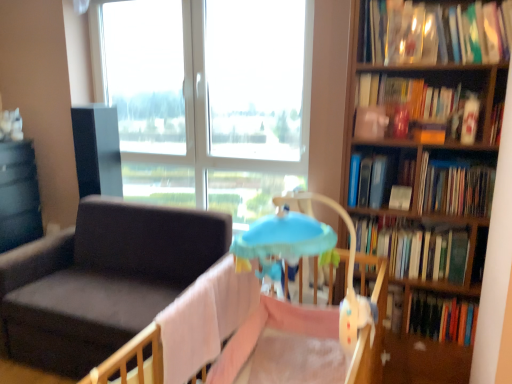
Image resolution: width=512 pixels, height=384 pixels. What do you see at coordinates (426, 220) in the screenshot? I see `wooden bookshelf at right` at bounding box center [426, 220].

What do you see at coordinates (18, 195) in the screenshot?
I see `matte black table at left` at bounding box center [18, 195].

Measure the distance between point (360, 180) and camera.

Point (360, 180) and camera are 6.72 feet apart.

What do you see at coordinates (416, 250) in the screenshot?
I see `hardcover book at right, the fifth book in the top-to-bottom sequence` at bounding box center [416, 250].

In order to face dark gray fabric chair at left, should I rotate leftwards or rightwards?

It's best to rotate left around 17.539 degrees.

The height and width of the screenshot is (384, 512). What do you see at coordinates (406, 105) in the screenshot?
I see `hardcover book at upper right, placed as the 5th book when sorted from bottom to top` at bounding box center [406, 105].

In order to face transparent glass window at upper center, should I rotate leftwards or rightwards?

Turn left by 7.454 degrees to look at transparent glass window at upper center.

The height and width of the screenshot is (384, 512). In order to click on pink fabric infant bed at center in this screenshot , I will do `click(253, 330)`.

Between pink fabric infant bed at center and hardcover book at upper right, which is counted as the third book, starting from the top, which one appears on the right side from the viewer's perspective?

hardcover book at upper right, which is counted as the third book, starting from the top, is more to the right.

Can you tell me how much pink fabric infant bed at center and hardcover book at upper right, which is counted as the third book, starting from the top, differ in facing direction?

2.36 degrees.

The height and width of the screenshot is (384, 512). I want to click on infant bed on the left of the hardcover book at upper right, which is counted as the third book, starting from the bottom, so click(x=253, y=330).

Considering the relative sizes of pink fabric infant bed at center and hardcover book at upper right, which is counted as the third book, starting from the top, in the image provided, is pink fabric infant bed at center thinner than hardcover book at upper right, which is counted as the third book, starting from the top,?

Incorrect, the width of pink fabric infant bed at center is not less than that of hardcover book at upper right, which is counted as the third book, starting from the top.

The image size is (512, 384). Find the location of `chair below the hardcover book at right, positioned as the 2th book in bottom-to-top order (from the image's perspective)`. chair below the hardcover book at right, positioned as the 2th book in bottom-to-top order (from the image's perspective) is located at coordinates (102, 280).

In the scene shown: Is dark gray fabric chair at left placed right next to hardcover book at right, which ranks as the 4th book in top-to-bottom order?

No, dark gray fabric chair at left is not touching hardcover book at right, which ranks as the 4th book in top-to-bottom order.

Is dark gray fabric chair at left to the left of hardcover book at right, positioned as the 2th book in bottom-to-top order, from the viewer's perspective?

Yes, dark gray fabric chair at left is to the left of hardcover book at right, positioned as the 2th book in bottom-to-top order.

Does dark gray fabric chair at left lie in front of hardcover book at right, which ranks as the 4th book in top-to-bottom order?

No, dark gray fabric chair at left is further to the viewer.

From the image's perspective, starting from the hardcover book at upper right, positioned as the first book in top-to-bottom order, which book is the 3rd one below? Please provide its 2D coordinates.

[(455, 188)]

Is hardcover book at right, which ranks as the 4th book in top-to-bottom order, outside of hardcover book at upper right, positioned as the first book in top-to-bottom order?

Yes, hardcover book at right, which ranks as the 4th book in top-to-bottom order, is located beyond the bounds of hardcover book at upper right, positioned as the first book in top-to-bottom order.

Considering the relative sizes of hardcover book at right, positioned as the 2th book in bottom-to-top order, and hardcover book at upper right, placed as the 5th book when sorted from bottom to top, in the image provided, is hardcover book at right, positioned as the 2th book in bottom-to-top order, wider than hardcover book at upper right, placed as the 5th book when sorted from bottom to top,?

A: Indeed, hardcover book at right, positioned as the 2th book in bottom-to-top order, has a greater width compared to hardcover book at upper right, placed as the 5th book when sorted from bottom to top.

Does hardcover book at right, positioned as the 2th book in bottom-to-top order, have a smaller size compared to hardcover book at upper right, placed as the 5th book when sorted from bottom to top?

Yes.

Is hardcover book at upper right, which is counted as the third book, starting from the top, looking in the opposite direction of hardcover book at right, positioned as the 2th book in bottom-to-top order?

hardcover book at upper right, which is counted as the third book, starting from the top, is not turned away from hardcover book at right, positioned as the 2th book in bottom-to-top order.

Is hardcover book at upper right, which is counted as the third book, starting from the top, taller or shorter than hardcover book at right, positioned as the 2th book in bottom-to-top order?

Clearly, hardcover book at upper right, which is counted as the third book, starting from the top, is shorter compared to hardcover book at right, positioned as the 2th book in bottom-to-top order.

Which is more to the left, hardcover book at upper right, which is counted as the third book, starting from the top, or hardcover book at right, which ranks as the 4th book in top-to-bottom order?

hardcover book at upper right, which is counted as the third book, starting from the top.

This screenshot has width=512, height=384. There is a hardcover book at upper right, which is counted as the third book, starting from the bottom. What are the coordinates of `the 1st book above it (from a real-world perspective)` in the screenshot? It's located at (455, 188).

Is hardcover book at upper right, which is counted as the third book, starting from the top, spatially inside transparent glass window at upper center, or outside of it?

hardcover book at upper right, which is counted as the third book, starting from the top, is outside transparent glass window at upper center.

From the image's perspective, would you say hardcover book at upper right, which is counted as the third book, starting from the bottom, is positioned over transparent glass window at upper center?

No, from the image's perspective, hardcover book at upper right, which is counted as the third book, starting from the bottom, is not on top of transparent glass window at upper center.

Is hardcover book at upper right, which is counted as the third book, starting from the bottom, shorter than transparent glass window at upper center?

Indeed, hardcover book at upper right, which is counted as the third book, starting from the bottom, has a lesser height compared to transparent glass window at upper center.

Does hardcover book at upper right, which is counted as the third book, starting from the bottom, have a lesser width compared to transparent glass window at upper center?

In fact, hardcover book at upper right, which is counted as the third book, starting from the bottom, might be wider than transparent glass window at upper center.

Based on their positions, is hardcover book at upper right, positioned as the first book in top-to-bottom order, located to the left or right of hardcover book at upper right, which is counted as the third book, starting from the bottom?

From the image, it's evident that hardcover book at upper right, positioned as the first book in top-to-bottom order, is to the right of hardcover book at upper right, which is counted as the third book, starting from the bottom.

From the image's perspective, is hardcover book at upper right, positioned as the first book in top-to-bottom order, located beneath hardcover book at upper right, which is counted as the third book, starting from the bottom?

Incorrect, from the image's perspective, hardcover book at upper right, positioned as the first book in top-to-bottom order, is higher than hardcover book at upper right, which is counted as the third book, starting from the bottom.

Are hardcover book at upper right, placed as the 5th book when sorted from bottom to top, and hardcover book at upper right, which is counted as the third book, starting from the top, beside each other?

No, hardcover book at upper right, placed as the 5th book when sorted from bottom to top, is not beside hardcover book at upper right, which is counted as the third book, starting from the top.

From a real-world perspective, which object stands above the other?

hardcover book at upper right, placed as the 5th book when sorted from bottom to top, is physically above.

Considering the sizes of objects pink fabric infant bed at center and hardcover book at right, positioned as the 2th book in bottom-to-top order, in the image provided, who is shorter, pink fabric infant bed at center or hardcover book at right, positioned as the 2th book in bottom-to-top order,?

Standing shorter between the two is hardcover book at right, positioned as the 2th book in bottom-to-top order.

Considering the positions of objects pink fabric infant bed at center and hardcover book at right, which ranks as the 4th book in top-to-bottom order, in the image provided, who is behind, pink fabric infant bed at center or hardcover book at right, which ranks as the 4th book in top-to-bottom order,?

hardcover book at right, which ranks as the 4th book in top-to-bottom order, is further away from the camera.

How distant is pink fabric infant bed at center from hardcover book at right, positioned as the 2th book in bottom-to-top order?

pink fabric infant bed at center and hardcover book at right, positioned as the 2th book in bottom-to-top order, are 75.68 centimeters apart.

Would you say pink fabric infant bed at center is to the left or to the right of hardcover book at right, which ranks as the 4th book in top-to-bottom order, in the picture?

Clearly, pink fabric infant bed at center is on the left of hardcover book at right, which ranks as the 4th book in top-to-bottom order, in the image.

Identify the location of the 2nd book directly above the pink fabric infant bed at center (from a real-world perspective). (378, 178).

The height and width of the screenshot is (384, 512). In order to click on the 2nd book above the dark gray fabric chair at left (from the image's perspective) in this screenshot , I will do `click(455, 188)`.

Based on their spatial positions, is pink fabric infant bed at center or wooden bookshelf at right closer to hardcover book at upper right, the second book from the top?

The object closer to hardcover book at upper right, the second book from the top, is wooden bookshelf at right.

Looking at the image, which one is located closer to hardcover book at right, which ranks as the 4th book in top-to-bottom order, hardcover book at right, the fifth book in the top-to-bottom sequence, or hardcover book at upper right, placed as the 5th book when sorted from bottom to top?

hardcover book at right, the fifth book in the top-to-bottom sequence, is positioned closer to the anchor hardcover book at right, which ranks as the 4th book in top-to-bottom order.

When comparing their distances from hardcover book at right, which ranks as the 1th book in bottom-to-top order, does pink fabric infant bed at center or hardcover book at upper right, which is counted as the third book, starting from the top, seem closer?

Based on the image, hardcover book at upper right, which is counted as the third book, starting from the top, appears to be nearer to hardcover book at right, which ranks as the 1th book in bottom-to-top order.

Based on their spatial positions, is matte black table at left or hardcover book at upper right, which is counted as the third book, starting from the bottom, further from hardcover book at upper right, placed as the 5th book when sorted from bottom to top?

Among the two, matte black table at left is located further to hardcover book at upper right, placed as the 5th book when sorted from bottom to top.

Based on the photo, estimate the real-world distances between objects in this image. Which object is closer to wooden bookshelf at right, hardcover book at upper right, positioned as the first book in top-to-bottom order, or hardcover book at right, positioned as the 2th book in bottom-to-top order?

Among the two, hardcover book at right, positioned as the 2th book in bottom-to-top order, is located nearer to wooden bookshelf at right.

Based on their spatial positions, is transparent glass window at upper center or pink fabric infant bed at center further from hardcover book at upper right, which is counted as the third book, starting from the bottom?

Based on the image, transparent glass window at upper center appears to be further to hardcover book at upper right, which is counted as the third book, starting from the bottom.

Estimate the real-world distances between objects in this image. Which object is further from wooden bookshelf at right, hardcover book at right, the fifth book in the top-to-bottom sequence, or pink fabric infant bed at center?

pink fabric infant bed at center.

Looking at the image, which one is located closer to transparent glass window at upper center, wooden bookshelf at right or hardcover book at right, which ranks as the 4th book in top-to-bottom order?

wooden bookshelf at right lies closer to transparent glass window at upper center than the other object.

In order to click on infant bed between dark gray fabric chair at left and hardcover book at right, which ranks as the 1th book in bottom-to-top order, from left to right in this screenshot , I will do `click(253, 330)`.

The width and height of the screenshot is (512, 384). I want to click on book between matte black table at left and hardcover book at right, which ranks as the 1th book in bottom-to-top order, in the horizontal direction, so click(378, 178).

I want to click on chair located between matte black table at left and hardcover book at right, which ranks as the 1th book in bottom-to-top order, in the left-right direction, so click(102, 280).

In order to click on window situated between dark gray fabric chair at left and hardcover book at upper right, which is counted as the third book, starting from the top, from left to right in this screenshot , I will do `click(208, 99)`.